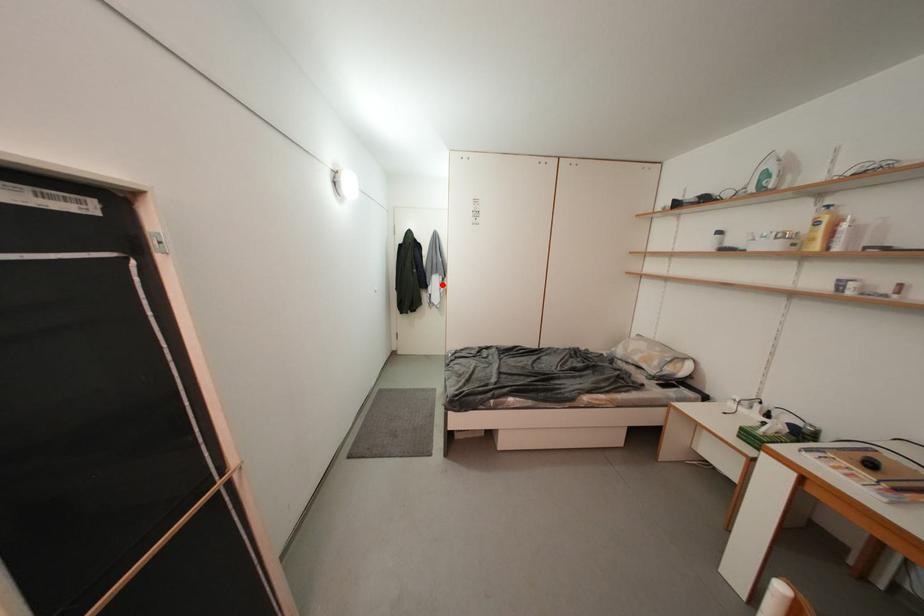
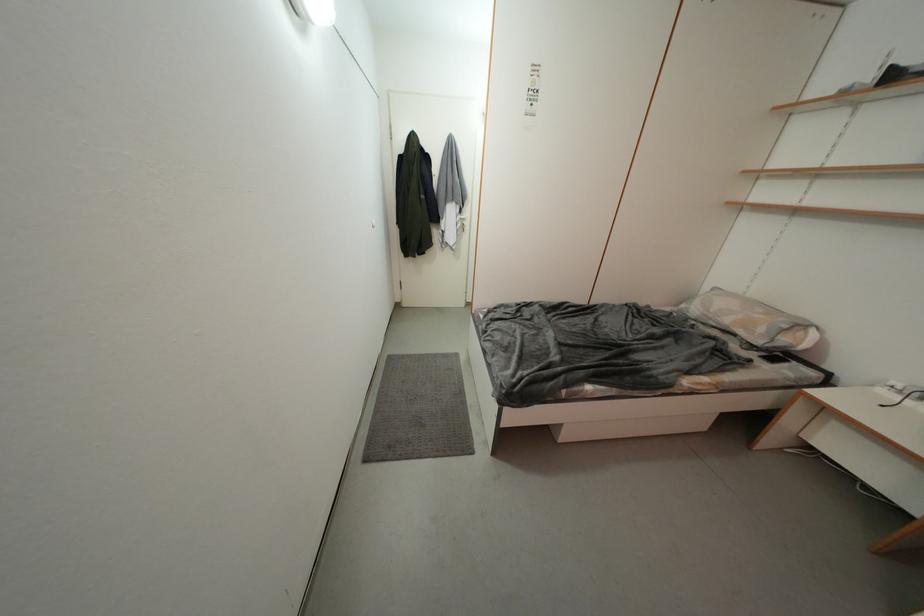
Question: I am providing you with two images of the same scene from different viewpoints. A red point is shown in image1. For the corresponding object point in image2, is it positioned nearer or farther from the camera?

Choices:
 (A) Nearer
 (B) Farther

Answer: (A)